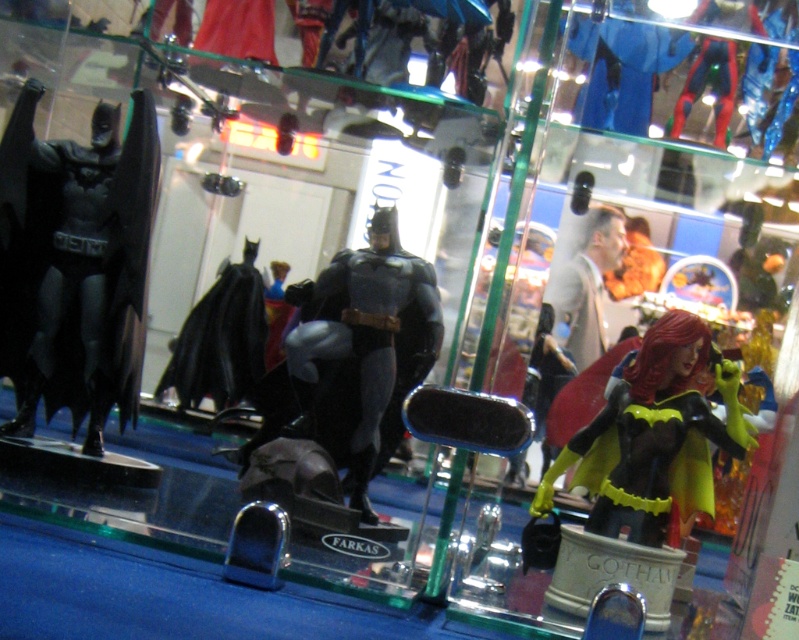
You are standing in front of the Batman action figure display. You want to reach a point located at coordinates point (603, 509). If your arm can extend 1 meter, will you be able to touch that point?

The distance of point (603, 509) from viewer is 1.13 meters, so your arm cannot reach it since it is 0.13 meters too far.